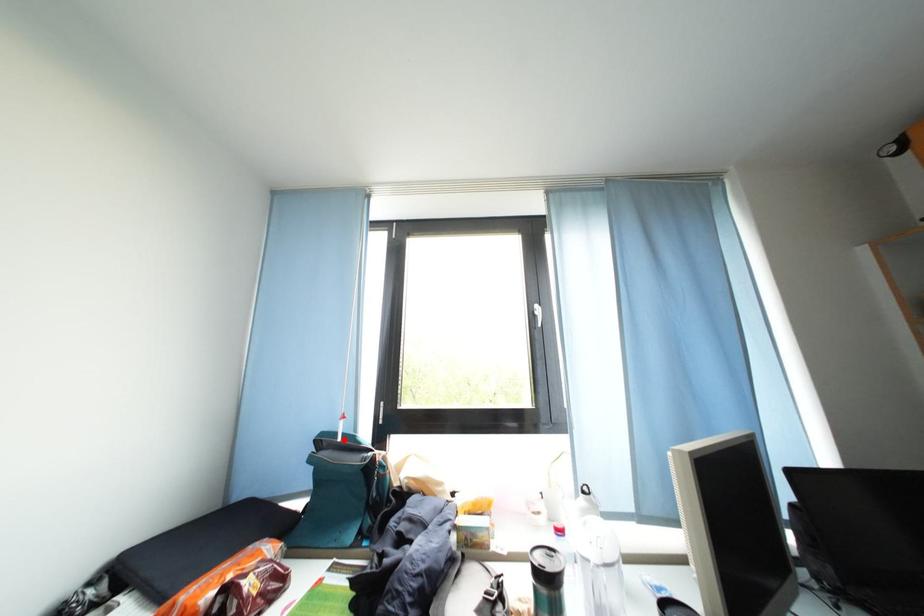
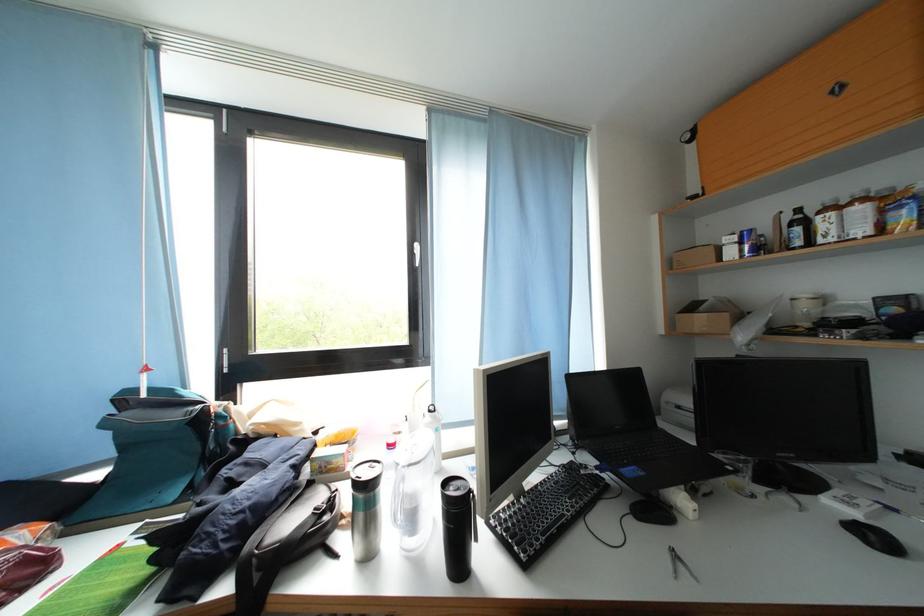
Question: I am providing you with two images of the same scene from different viewpoints. Image1 has a red point marked. In image2, the corresponding 3D location appears at what relative position? Reply with the corresponding letter.

Choices:
 (A) Closer
 (B) Farther

Answer: (A)